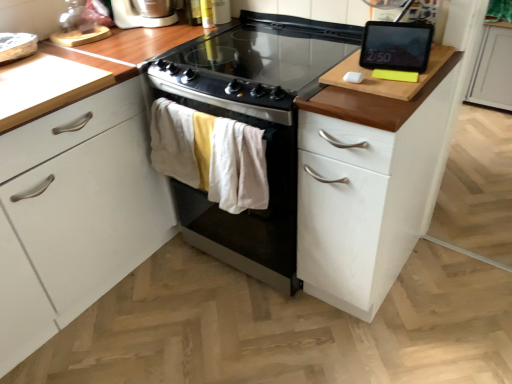
I want to click on free space above white wood cabinet at right (from a real-world perspective), so click(389, 78).